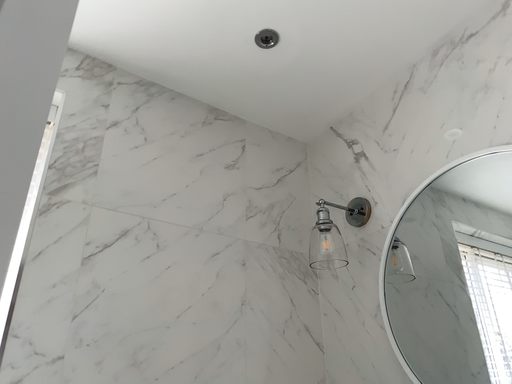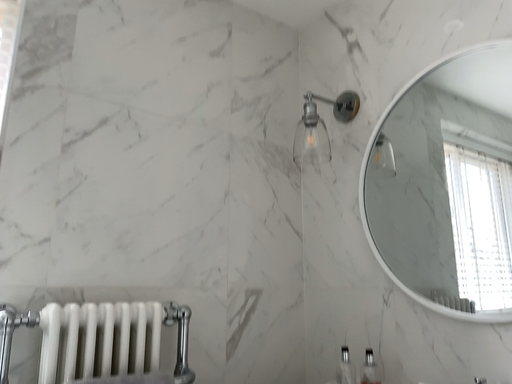
Question: How did the camera likely rotate when shooting the video?

Choices:
 (A) rotated downward
 (B) rotated upward

Answer: (A)